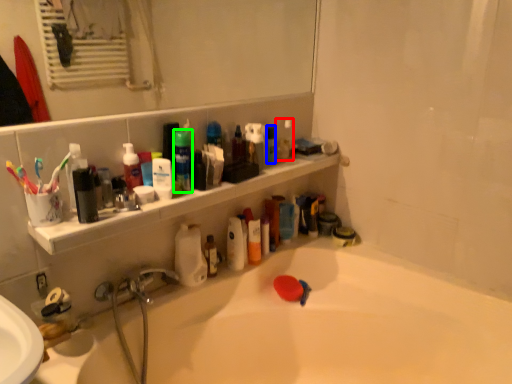
Question: Which is farther away from toiletry (highlighted by a red box)? toiletry (highlighted by a blue box) or mouthwash (highlighted by a green box)?

Choices:
 (A) toiletry
 (B) mouthwash

Answer: (B)